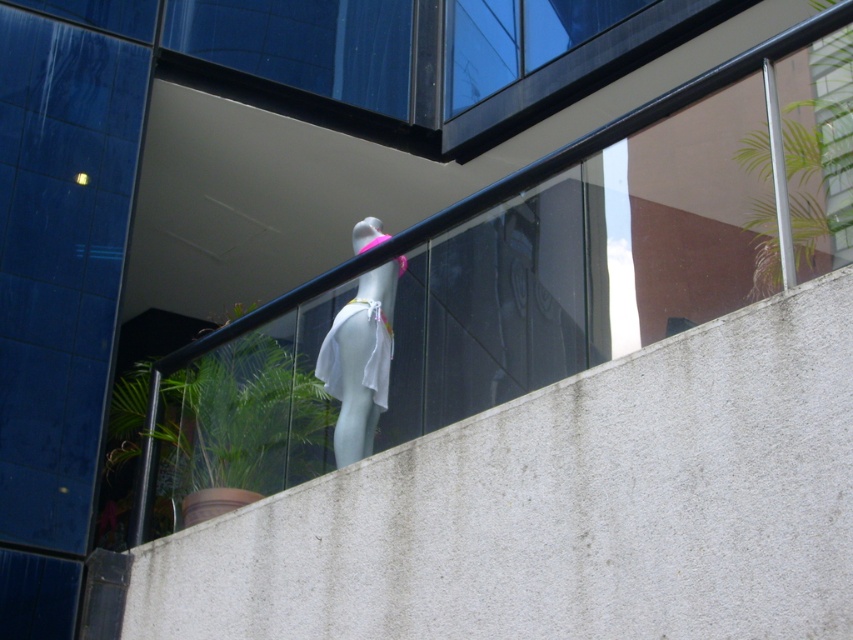
Question: Is white concrete ledge at center positioned in front of white matte mannequin at center?

Choices:
 (A) no
 (B) yes

Answer: (B)

Question: Which object is farther from the camera taking this photo?

Choices:
 (A) white concrete ledge at center
 (B) white matte mannequin at center

Answer: (B)

Question: Which of the following is the closest to the observer?

Choices:
 (A) white matte mannequin at center
 (B) white concrete ledge at center

Answer: (B)

Question: Can you confirm if white concrete ledge at center is wider than white matte mannequin at center?

Choices:
 (A) no
 (B) yes

Answer: (B)

Question: Considering the relative positions of white concrete ledge at center and white matte mannequin at center in the image provided, where is white concrete ledge at center located with respect to white matte mannequin at center?

Choices:
 (A) left
 (B) right

Answer: (B)